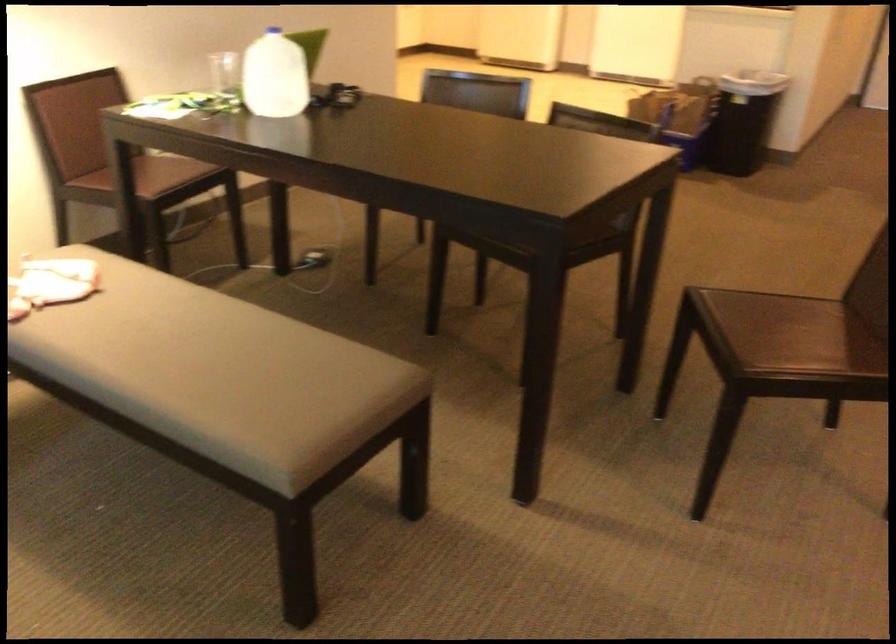
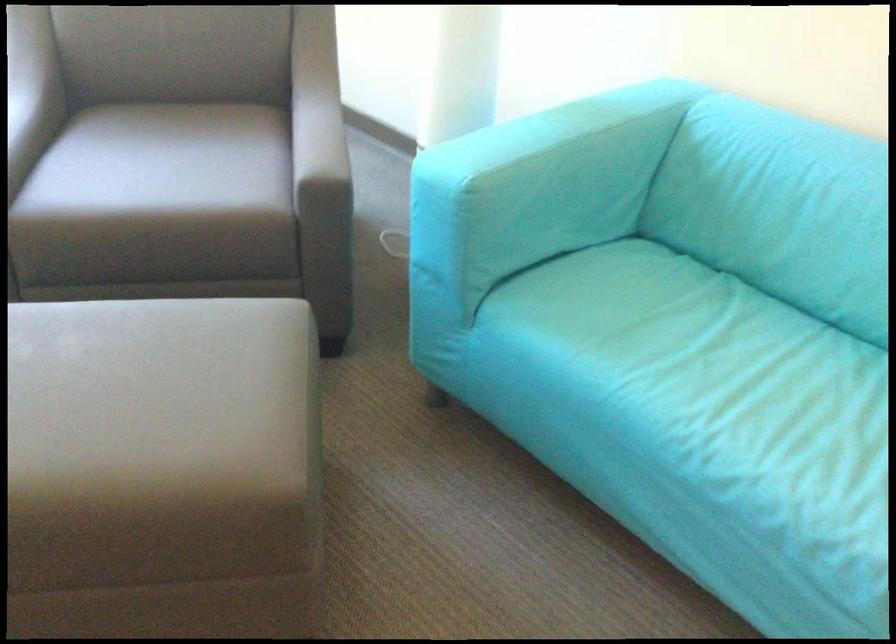
First-person continuous shooting, in which direction is the camera rotating?

The rotation direction of the camera is left-down.